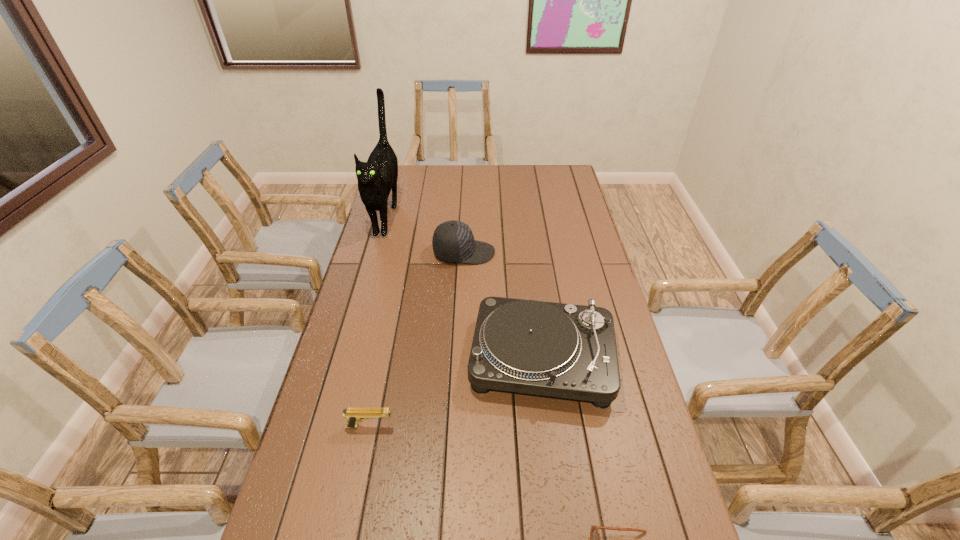
This screenshot has width=960, height=540. Identify the location of the tallest object. (376, 177).

Find the location of a particular element. This screenshot has width=960, height=540. record player is located at coordinates (560, 350).

You are a GUI agent. You are given a task and a screenshot of the screen. Output one action in this format:
    pyautogui.click(x=<x>, y=<y>)
    Task: Click on the baseball cap
    
    Given the screenshot: What is the action you would take?
    (x=453, y=241)

Locate an element on the screen. This screenshot has height=540, width=960. the second shortest object is located at coordinates tap(353, 415).

Locate an element on the screen. The height and width of the screenshot is (540, 960). the fourth farthest object is located at coordinates (353, 415).

Locate an element on the screen. free spot located on the face of the tallest object is located at coordinates (373, 262).

I want to click on free point located 0.290m on the back of the third nearest object, so click(529, 259).

The image size is (960, 540). I want to click on vacant space positioned at the front of the baseball cap where the brim is located, so click(558, 253).

Find the location of a particular element. The height and width of the screenshot is (540, 960). free space located 0.290m at the barrel of the second nearest object is located at coordinates (505, 426).

Image resolution: width=960 pixels, height=540 pixels. What are the coordinates of `object located at the far edge` in the screenshot? It's located at (376, 177).